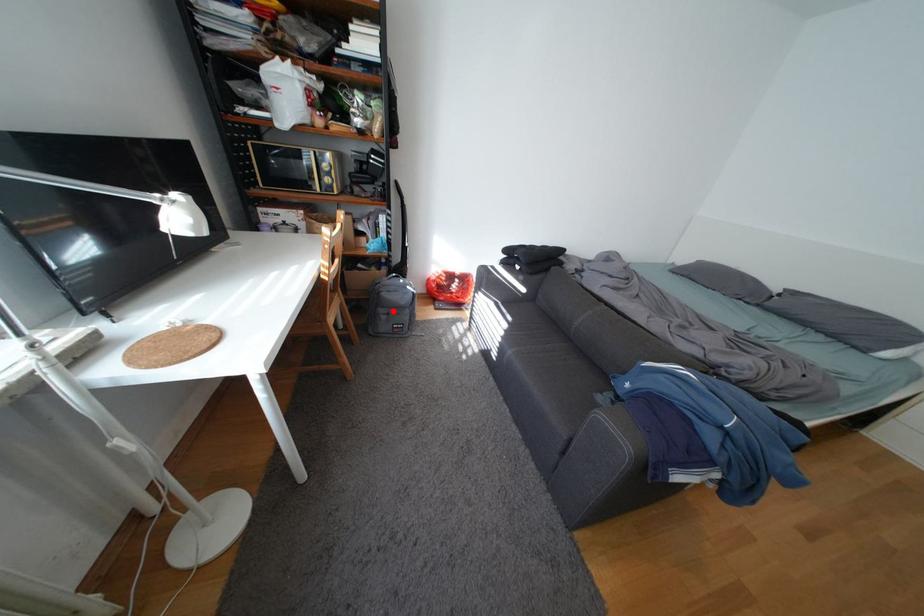
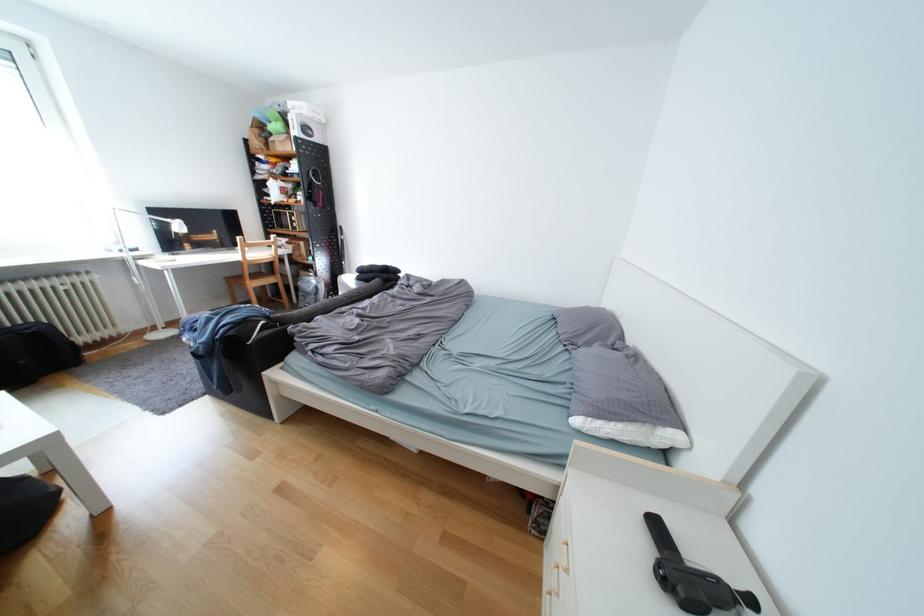
Question: I am providing you with two images of the same scene from different viewpoints. Image1 has a red point marked. In image2, the corresponding 3D location appears at what relative position? Reply with the corresponding letter.

Choices:
 (A) Closer
 (B) Farther

Answer: (B)